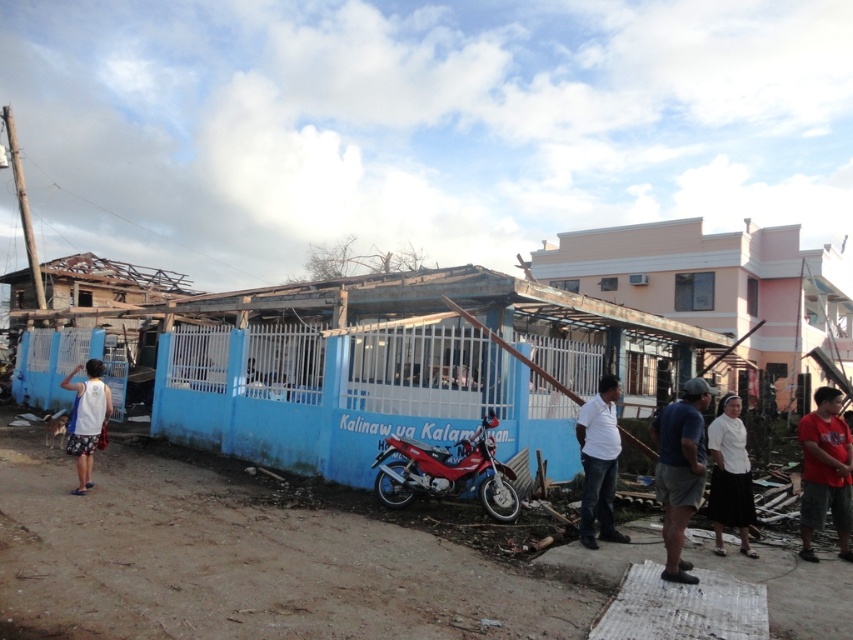
Does point (686, 387) lie in front of point (74, 397)?

Yes, it is.

Which of these two, brown fabric shorts at lower right or white fabric bag at left, stands shorter?

Standing shorter between the two is white fabric bag at left.

What do you see at coordinates (680, 470) in the screenshot? I see `brown fabric shorts at lower right` at bounding box center [680, 470].

The height and width of the screenshot is (640, 853). I want to click on brown fabric shorts at lower right, so click(680, 470).

Is point (453, 490) less distant than point (587, 451)?

No, it is not.

Between point (439, 467) and point (584, 509), which one is positioned in front?

Point (584, 509)

Is point (440, 465) positioned after point (601, 483)?

That is True.

Identify the location of red matte motorcycle at center. The width and height of the screenshot is (853, 640). (447, 472).

Does brown fabric shorts at lower right have a greater height compared to white cotton shirt at center?

No.

Which is more to the right, brown fabric shorts at lower right or white cotton shirt at center?

From the viewer's perspective, brown fabric shorts at lower right appears more on the right side.

Image resolution: width=853 pixels, height=640 pixels. Describe the element at coordinates (680, 470) in the screenshot. I see `brown fabric shorts at lower right` at that location.

You are a GUI agent. You are given a task and a screenshot of the screen. Output one action in this format:
    pyautogui.click(x=<x>, y=<y>)
    Task: Click on the brown fabric shorts at lower right
    The height and width of the screenshot is (640, 853).
    Given the screenshot: What is the action you would take?
    pyautogui.click(x=680, y=470)